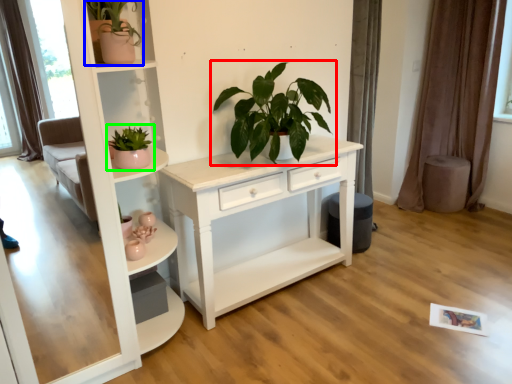
Question: Estimate the real-world distances between objects in this image. Which object is closer to houseplant (highlighted by a red box), houseplant (highlighted by a blue box) or houseplant (highlighted by a green box)?

Choices:
 (A) houseplant
 (B) houseplant

Answer: (B)